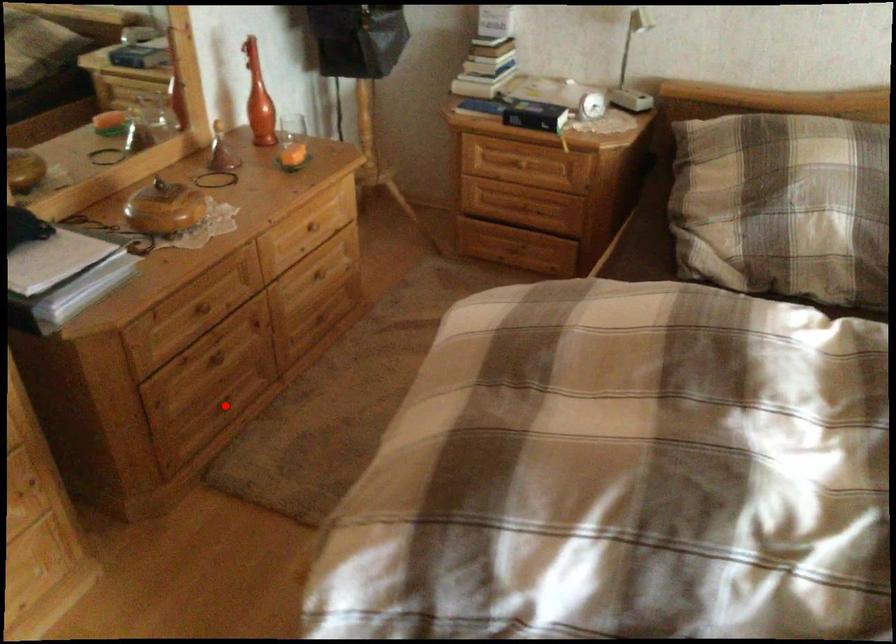
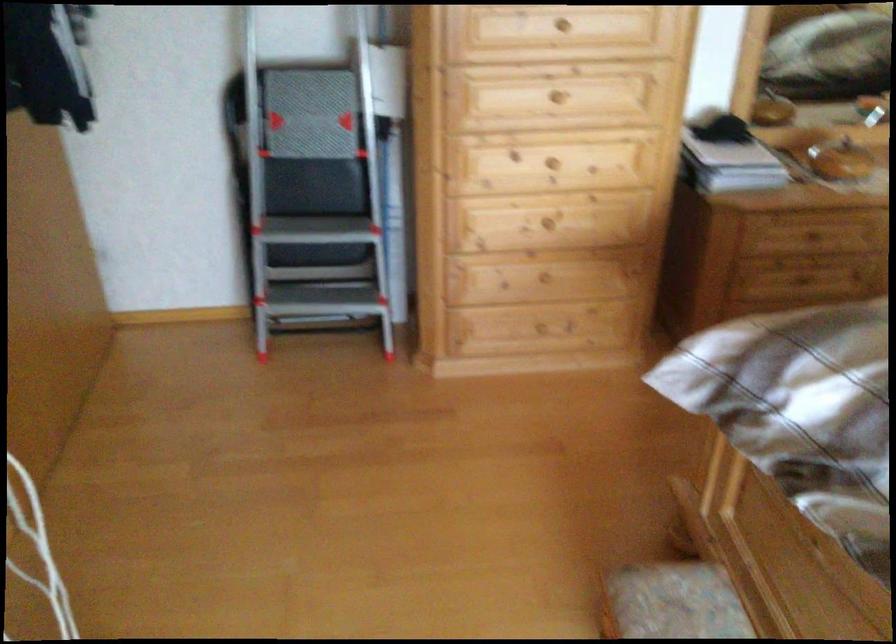
Question: I am providing you with two images of the same scene from different viewpoints. A red point is marked on the first image. Can you still see the location of the red point in image 2?

Choices:
 (A) Yes
 (B) No

Answer: (B)